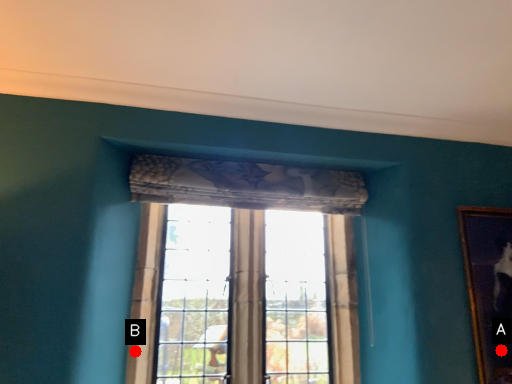
Question: Two points are circled on the image, labeled by A and B beside each circle. Which point appears closest to the camera in this image?

Choices:
 (A) A is closer
 (B) B is closer

Answer: (B)